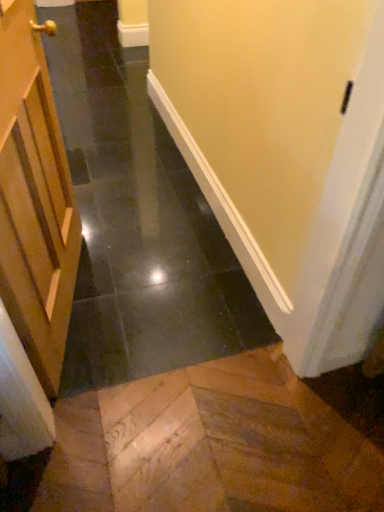
Question: Should I look upward or downward to see black glossy tile at center?

Choices:
 (A) down
 (B) up

Answer: (A)

Question: From the image's perspective, is black glossy tile at center over wooden door at left?

Choices:
 (A) yes
 (B) no

Answer: (B)

Question: Are black glossy tile at center and wooden door at left far apart?

Choices:
 (A) yes
 (B) no

Answer: (B)

Question: Is black glossy tile at center closer to camera compared to wooden door at left?

Choices:
 (A) yes
 (B) no

Answer: (A)

Question: Is black glossy tile at center to the right of wooden door at left from the viewer's perspective?

Choices:
 (A) yes
 (B) no

Answer: (A)

Question: Would you say black glossy tile at center is outside wooden door at left?

Choices:
 (A) no
 (B) yes

Answer: (B)

Question: Is black glossy tile at center at the left side of wooden door at left?

Choices:
 (A) yes
 (B) no

Answer: (B)

Question: Can you confirm if wooden door at left is thinner than black glossy tile at center?

Choices:
 (A) no
 (B) yes

Answer: (B)

Question: Is wooden door at left turned away from black glossy tile at center?

Choices:
 (A) no
 (B) yes

Answer: (A)

Question: Does wooden door at left have a lesser height compared to black glossy tile at center?

Choices:
 (A) no
 (B) yes

Answer: (B)

Question: Does wooden door at left lie in front of black glossy tile at center?

Choices:
 (A) no
 (B) yes

Answer: (A)

Question: Is wooden door at left wider than black glossy tile at center?

Choices:
 (A) yes
 (B) no

Answer: (B)

Question: From a real-world perspective, is wooden door at left located higher than black glossy tile at center?

Choices:
 (A) no
 (B) yes

Answer: (A)

Question: From the image's perspective, is wooden door at left located above or below black glossy tile at center?

Choices:
 (A) below
 (B) above

Answer: (B)